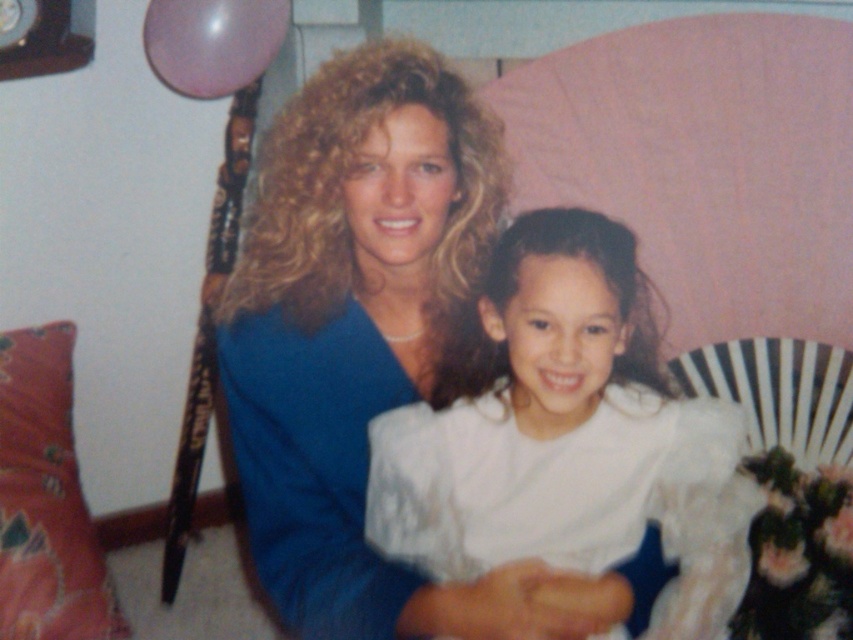
Question: Can you confirm if blue satin dress at center is positioned to the left of floral fabric pillow at lower left?

Choices:
 (A) yes
 (B) no

Answer: (B)

Question: Does white satin dress at center have a larger size compared to floral fabric pillow at lower left?

Choices:
 (A) no
 (B) yes

Answer: (A)

Question: Which object is farther from the camera taking this photo?

Choices:
 (A) blue satin dress at center
 (B) white satin dress at center
 (C) floral fabric pillow at lower left

Answer: (C)

Question: Which point is closer to the camera taking this photo?

Choices:
 (A) (310, 490)
 (B) (572, 406)

Answer: (B)

Question: Estimate the real-world distances between objects in this image. Which object is farther from the floral fabric pillow at lower left?

Choices:
 (A) blue satin dress at center
 (B) white satin dress at center

Answer: (B)

Question: Considering the relative positions of white satin dress at center and floral fabric pillow at lower left in the image provided, where is white satin dress at center located with respect to floral fabric pillow at lower left?

Choices:
 (A) right
 (B) left

Answer: (A)